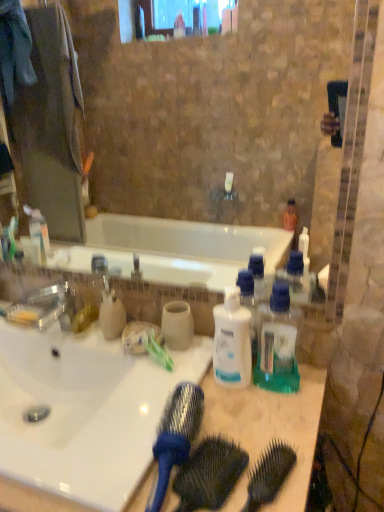
I want to click on free space in front of matte beige soap dispenser at center-left, so click(x=126, y=380).